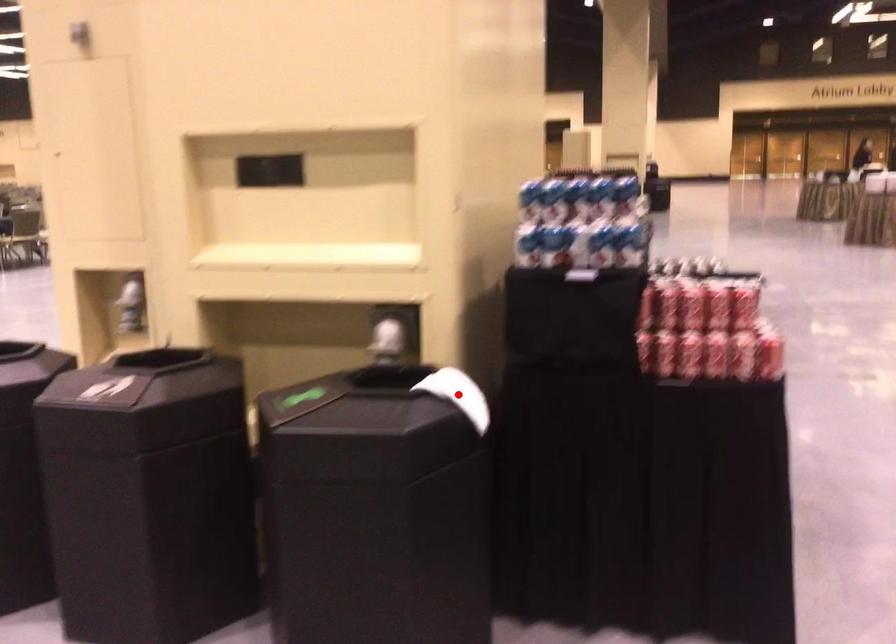
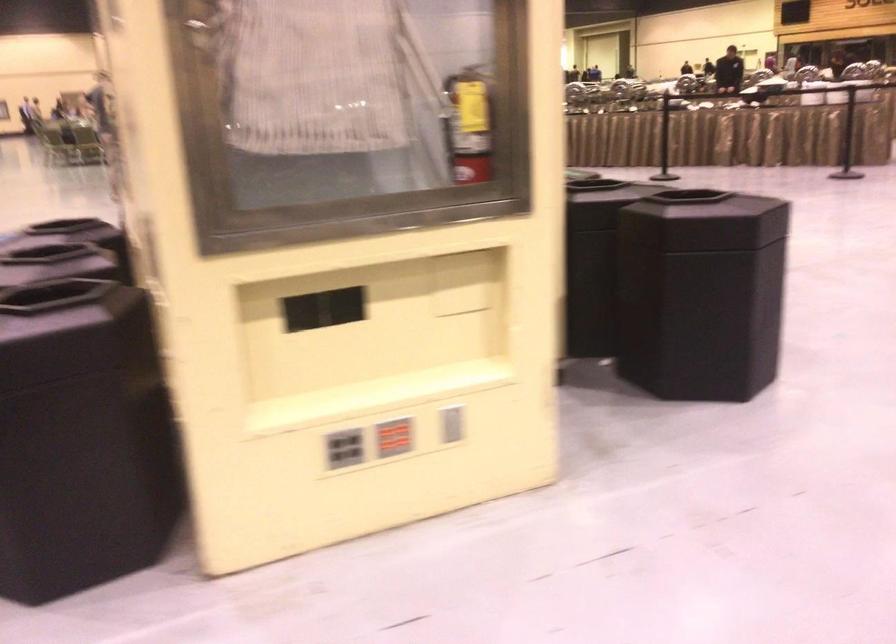
Question: I am providing you with two images of the same scene from different viewpoints. A red point is marked on the first image. Can you still see the location of the red point in image 2?

Choices:
 (A) Yes
 (B) No

Answer: (B)